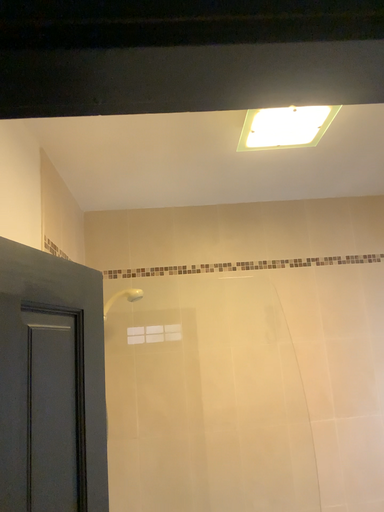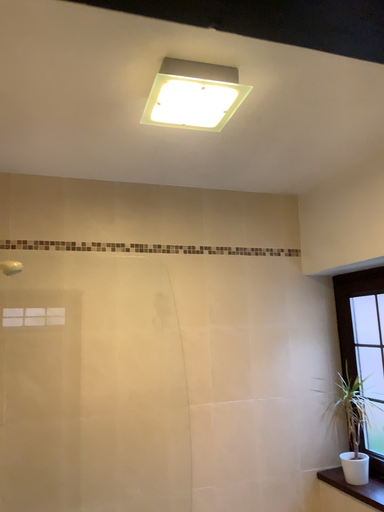
Question: How did the camera likely rotate when shooting the video?

Choices:
 (A) rotated right
 (B) rotated left

Answer: (A)